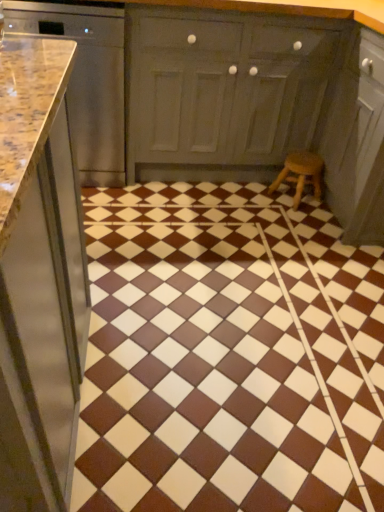
This screenshot has height=512, width=384. I want to click on free space in front of wooden stool at lower right, so click(x=301, y=217).